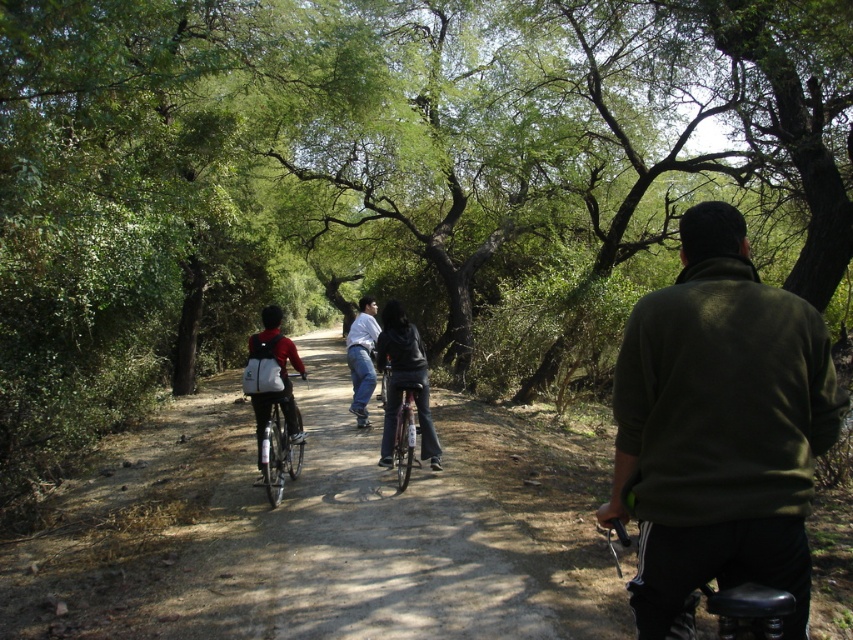
Question: Can you confirm if dirt path at center is bigger than silver metallic bicycle at center?

Choices:
 (A) yes
 (B) no

Answer: (A)

Question: Which point is closer to the camera?

Choices:
 (A) (256, 531)
 (B) (289, 467)
 (C) (399, 481)

Answer: (A)

Question: Estimate the real-world distances between objects in this image. Which object is closer to the metallic silver bicycle at center?

Choices:
 (A) olive-green sweater at center
 (B) dirt path at center
 (C) silver metallic bicycle at center
 (D) matte black jacket at center

Answer: (D)

Question: Is matte black jacket at center further to the viewer compared to metallic silver bicycle at center?

Choices:
 (A) yes
 (B) no

Answer: (A)

Question: Does dirt path at center have a larger size compared to silver metallic bicycle at center?

Choices:
 (A) no
 (B) yes

Answer: (B)

Question: Which point is closer to the camera?

Choices:
 (A) silver metallic bicycle at center
 (B) metallic silver bicycle at center

Answer: (A)